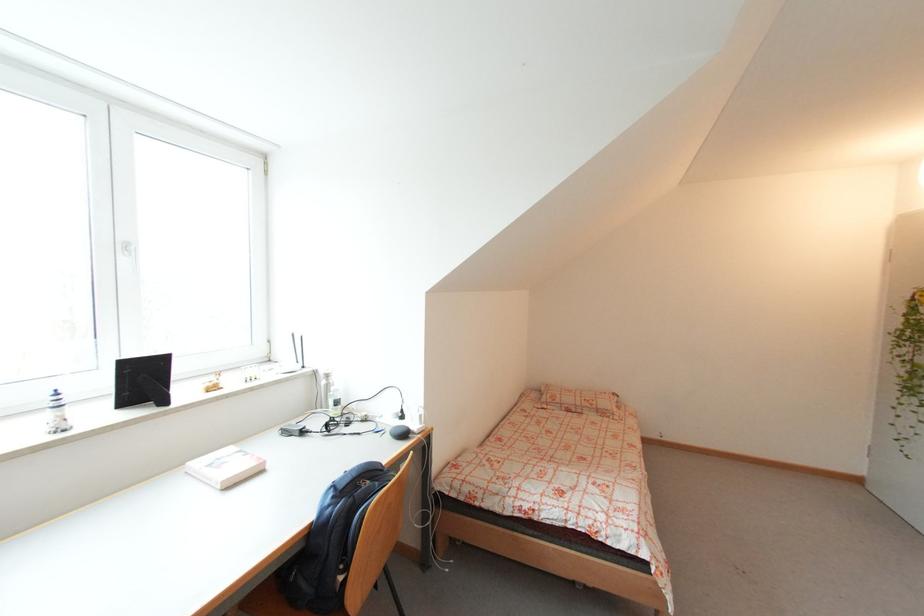
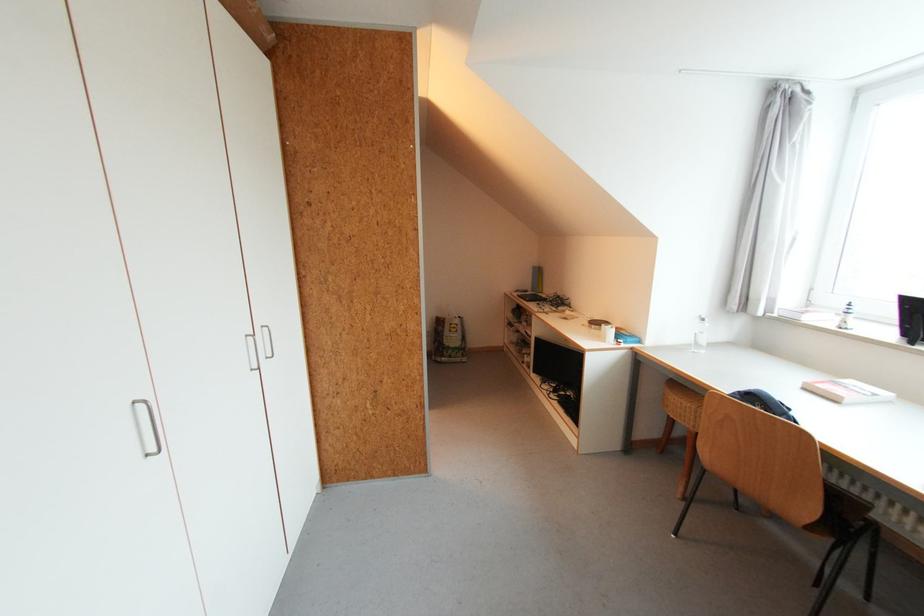
Find the pixel in the second image that matches [266,472] in the first image.

(841, 403)